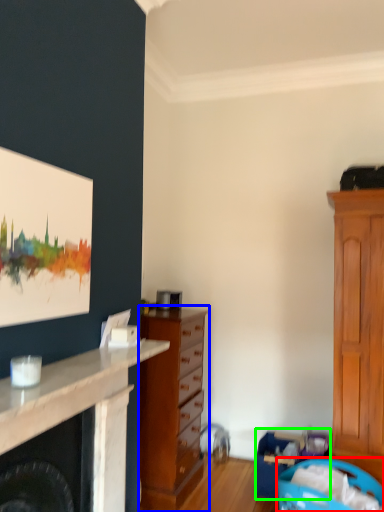
Question: Based on their relative distances, which object is nearer to laundry basket (highlighted by a red box)? Choose from chest of drawers (highlighted by a blue box) and laundry basket (highlighted by a green box).

Choices:
 (A) chest of drawers
 (B) laundry basket

Answer: (B)